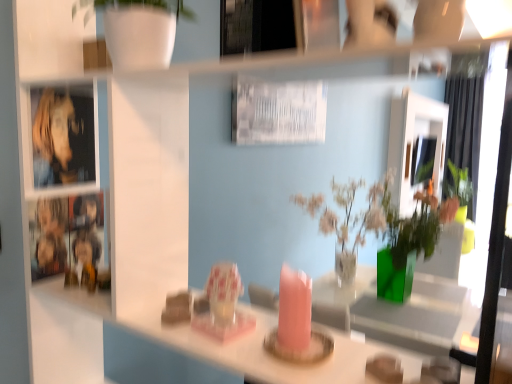
Question: From the image's perspective, is green fabric curtain at right located above or below metallic reflective cabinet at left?

Choices:
 (A) below
 (B) above

Answer: (B)

Question: From a real-world perspective, is green fabric curtain at right physically located above or below metallic reflective cabinet at left?

Choices:
 (A) above
 (B) below

Answer: (B)

Question: Which of these objects is positioned farthest from the metallic reflective cabinet at left?

Choices:
 (A) green fabric curtain at right
 (B) metallic silver picture frame at upper center
 (C) matte white mirror at upper center

Answer: (C)

Question: Estimate the real-world distances between objects in this image. Which object is farther from the metallic reflective cabinet at left?

Choices:
 (A) matte white mirror at upper center
 (B) metallic silver picture frame at upper center
 (C) green fabric curtain at right

Answer: (A)